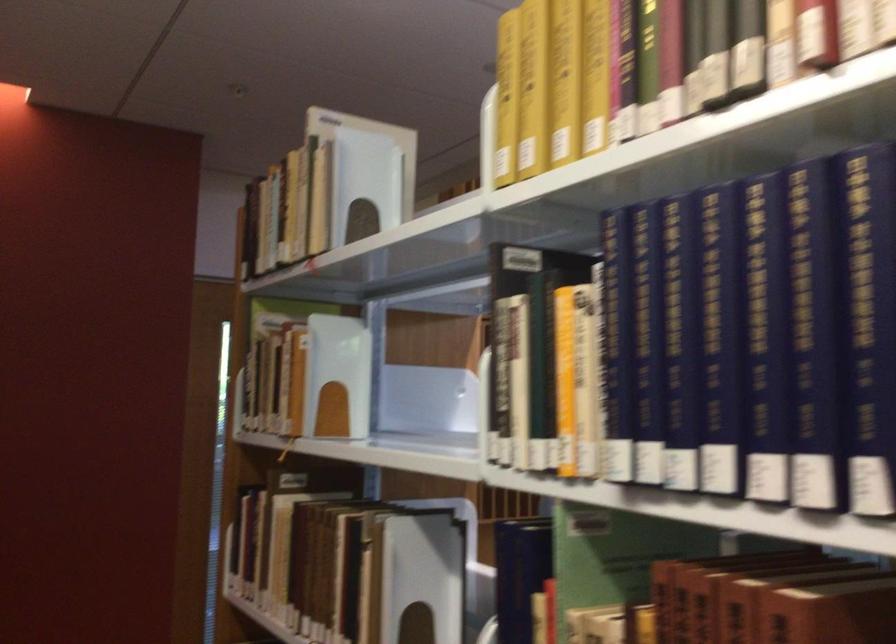
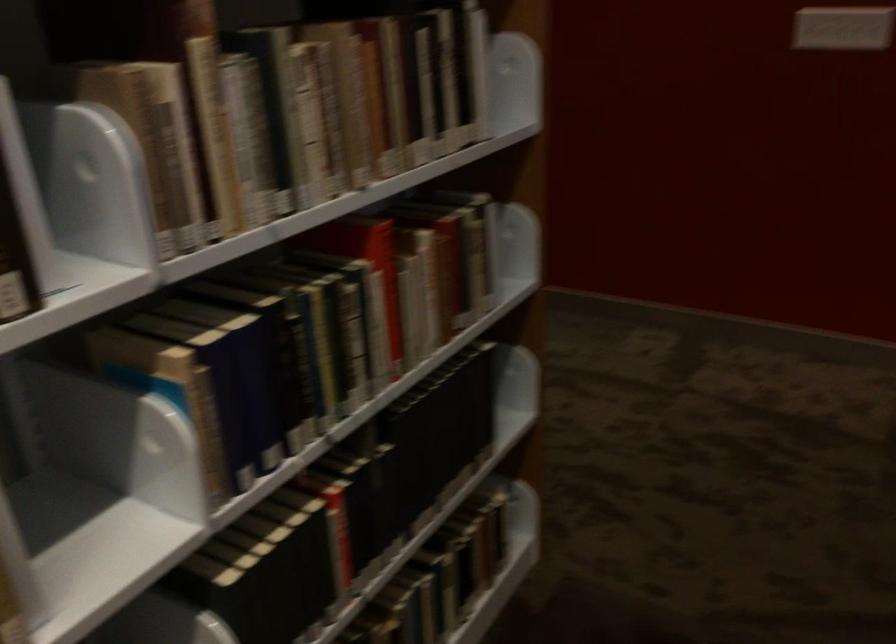
First-person continuous shooting, in which direction is the camera rotating?

The camera's rotation is toward left-down.